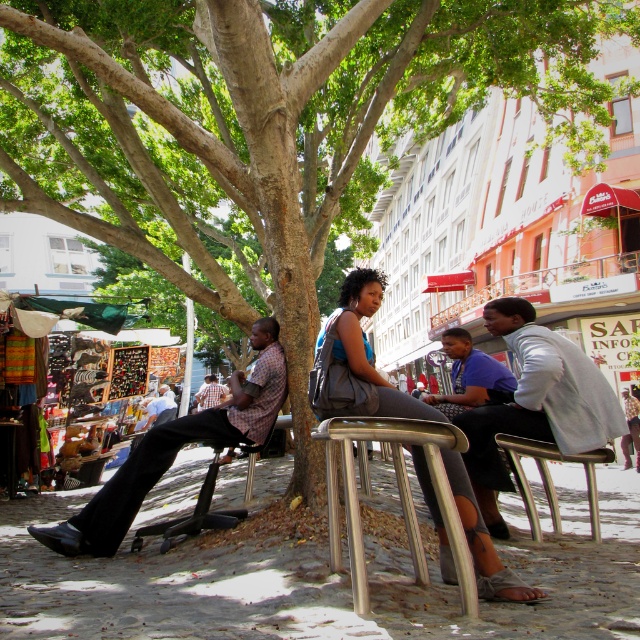
You are a photographer standing near the metallic silver chair at center and the matte gray tank top at center. You want to capture a photo that includes both subjects without any overlap. Given that your camera has a maximum focus range of 20 inches, can you position yourself to achieve this?

The distance between the metallic silver chair at center and the matte gray tank top at center is 19.16 inches, which is within the camera maximum focus range of 20 inches. Therefore, you can position yourself to capture both subjects without overlap.

You are standing at the center of the cobblestone street under the tree. You see a point marked at coordinates (536,403). Which object is located at that point?

The point at coordinates (536,403) corresponds to the light gray jacket at center.

You are a fashion designer observing the crowd under the tree. You notice two people wearing the matte gray tank top at center and the blue shirt at center. Which clothing item appears to be smaller in size?

The matte gray tank top at center has a smaller size compared to the blue shirt at center.